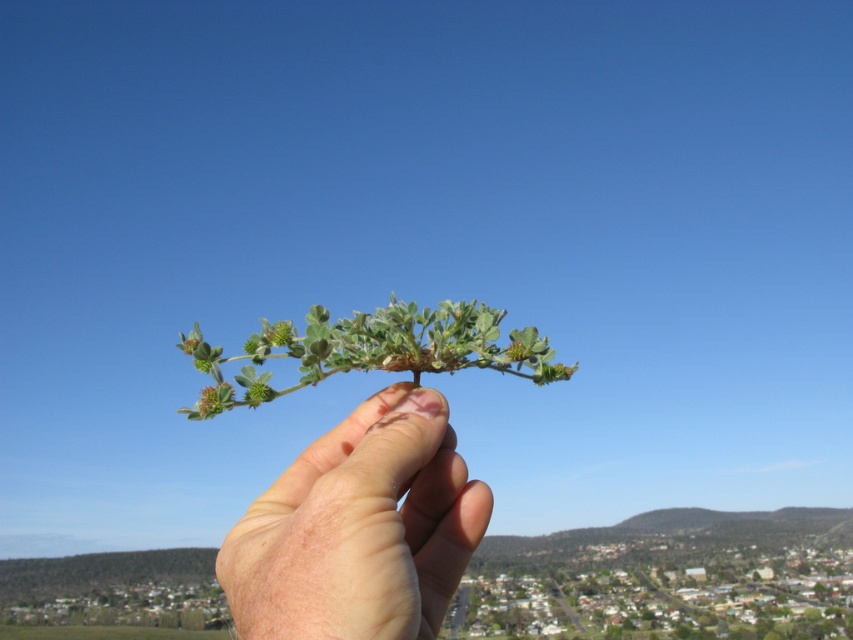
Question: Which object appears farthest from the camera in this image?

Choices:
 (A) pale skin/flesh at center
 (B) green matte leafy branch at center

Answer: (B)

Question: Can you confirm if pale skin/flesh at center is positioned to the left of green matte leafy branch at center?

Choices:
 (A) no
 (B) yes

Answer: (A)

Question: Which point is farther to the camera?

Choices:
 (A) (383, 355)
 (B) (270, 593)

Answer: (A)

Question: Does pale skin/flesh at center appear over green matte leafy branch at center?

Choices:
 (A) no
 (B) yes

Answer: (A)

Question: Does pale skin/flesh at center come behind green matte leafy branch at center?

Choices:
 (A) no
 (B) yes

Answer: (A)

Question: Which object appears closest to the camera in this image?

Choices:
 (A) pale skin/flesh at center
 (B) green matte leafy branch at center

Answer: (A)